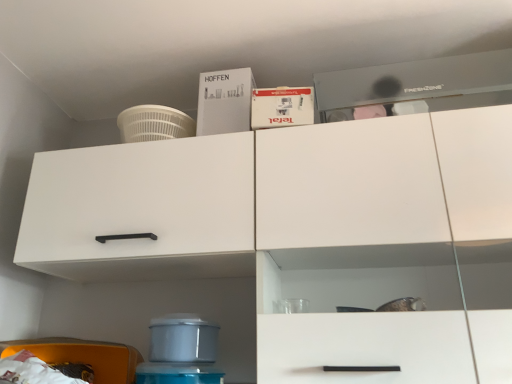
Question: Is white matte cabinet at left facing away from white cardboard box at upper center, which ranks as the first box in front-to-back order?

Choices:
 (A) yes
 (B) no

Answer: (B)

Question: Is white matte cabinet at left not inside white cardboard box at upper center, placed as the second box when sorted from back to front?

Choices:
 (A) no
 (B) yes

Answer: (B)

Question: Can you confirm if white matte cabinet at left is positioned to the right of white cardboard box at upper center, the 2th box when ordered from left to right?

Choices:
 (A) yes
 (B) no

Answer: (B)

Question: Can you confirm if white matte cabinet at left is positioned to the left of white cardboard box at upper center, the 2th box when ordered from left to right?

Choices:
 (A) yes
 (B) no

Answer: (A)

Question: From the image's perspective, is white matte cabinet at left over white cardboard box at upper center, the 2th box when ordered from left to right?

Choices:
 (A) yes
 (B) no

Answer: (B)

Question: Considering the positions of white matte box at upper center, the 2th box positioned from the right, and white matte cabinet at left in the image, is white matte box at upper center, the 2th box positioned from the right, taller or shorter than white matte cabinet at left?

Choices:
 (A) short
 (B) tall

Answer: (A)

Question: Is white matte box at upper center, the 2th box positioned from the right, in front of or behind white matte cabinet at left in the image?

Choices:
 (A) behind
 (B) front

Answer: (A)

Question: Looking at their shapes, would you say white matte box at upper center, placed as the 2th box when sorted from front to back, is wider or thinner than white matte cabinet at left?

Choices:
 (A) thin
 (B) wide

Answer: (A)

Question: Do you think white matte box at upper center, the 1th box in the back-to-front sequence, is within white matte cabinet at left, or outside of it?

Choices:
 (A) outside
 (B) inside

Answer: (A)

Question: Is white matte box at upper center, the 2th box positioned from the right, in front of or behind white cardboard box at upper center, the 2th box when ordered from left to right, in the image?

Choices:
 (A) behind
 (B) front

Answer: (A)

Question: Does point click(222, 104) appear closer or farther from the camera than point click(264, 120)?

Choices:
 (A) farther
 (B) closer

Answer: (A)

Question: In terms of width, does white matte box at upper center, which is the 1th box in left-to-right order, look wider or thinner when compared to white cardboard box at upper center, the 2th box when ordered from left to right?

Choices:
 (A) thin
 (B) wide

Answer: (A)

Question: Do you think white matte box at upper center, the 2th box positioned from the right, is within white cardboard box at upper center, the 2th box when ordered from left to right, or outside of it?

Choices:
 (A) inside
 (B) outside

Answer: (B)

Question: From the image's perspective, is white matte cabinet at left positioned above or below white cardboard box at upper center, which is the first box in right-to-left order?

Choices:
 (A) above
 (B) below

Answer: (B)

Question: Is white matte cabinet at left wider or thinner than white cardboard box at upper center, which ranks as the first box in front-to-back order?

Choices:
 (A) wide
 (B) thin

Answer: (A)